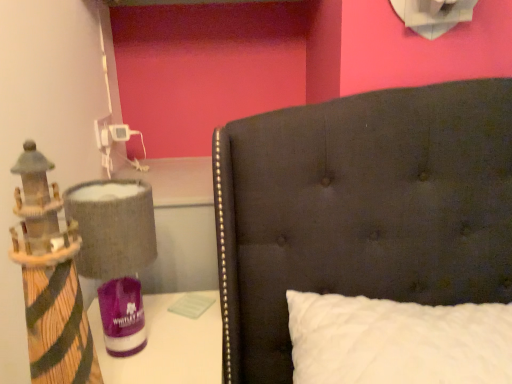
Question: From a real-world perspective, does textured fabric lampshade at left stand above wooden lighthouse at left?

Choices:
 (A) no
 (B) yes

Answer: (A)

Question: Is textured fabric lampshade at left outside wooden lighthouse at left?

Choices:
 (A) no
 (B) yes

Answer: (B)

Question: Are textured fabric lampshade at left and wooden lighthouse at left far apart?

Choices:
 (A) yes
 (B) no

Answer: (B)

Question: From the image's perspective, is textured fabric lampshade at left over wooden lighthouse at left?

Choices:
 (A) yes
 (B) no

Answer: (B)

Question: Is textured fabric lampshade at left further to the viewer compared to wooden lighthouse at left?

Choices:
 (A) yes
 (B) no

Answer: (A)

Question: From the image's perspective, does textured fabric lampshade at left appear lower than wooden lighthouse at left?

Choices:
 (A) yes
 (B) no

Answer: (A)

Question: Is white quilted pillow at center in front of textured fabric lampshade at left?

Choices:
 (A) no
 (B) yes

Answer: (B)

Question: Is white quilted pillow at center oriented away from textured fabric lampshade at left?

Choices:
 (A) no
 (B) yes

Answer: (A)

Question: Does white quilted pillow at center appear on the right side of textured fabric lampshade at left?

Choices:
 (A) yes
 (B) no

Answer: (A)

Question: Does white quilted pillow at center have a smaller size compared to textured fabric lampshade at left?

Choices:
 (A) no
 (B) yes

Answer: (A)

Question: Is white quilted pillow at center at the left side of textured fabric lampshade at left?

Choices:
 (A) no
 (B) yes

Answer: (A)

Question: Does white quilted pillow at center have a greater width compared to textured fabric lampshade at left?

Choices:
 (A) no
 (B) yes

Answer: (B)

Question: From the image's perspective, is wooden lighthouse at left on textured fabric lampshade at left?

Choices:
 (A) yes
 (B) no

Answer: (A)